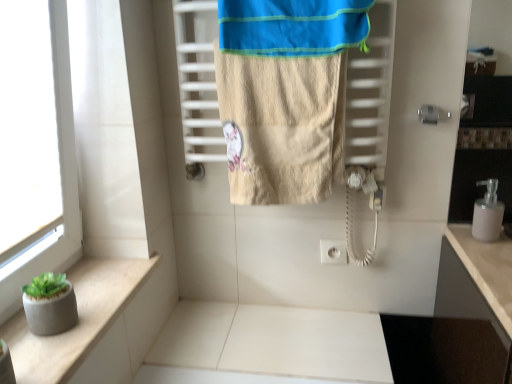
Question: Considering the relative positions of pink matte soap dispenser at right and beige textured towel at center in the image provided, is pink matte soap dispenser at right behind beige textured towel at center?

Choices:
 (A) no
 (B) yes

Answer: (B)

Question: Does pink matte soap dispenser at right turn towards beige textured towel at center?

Choices:
 (A) no
 (B) yes

Answer: (A)

Question: Can you confirm if pink matte soap dispenser at right is positioned to the right of beige textured towel at center?

Choices:
 (A) yes
 (B) no

Answer: (A)

Question: From a real-world perspective, is pink matte soap dispenser at right on beige textured towel at center?

Choices:
 (A) yes
 (B) no

Answer: (B)

Question: Can you confirm if pink matte soap dispenser at right is taller than beige textured towel at center?

Choices:
 (A) yes
 (B) no

Answer: (B)

Question: In terms of width, does pink matte soap dispenser at right look wider or thinner when compared to concrete planter at lower left?

Choices:
 (A) wide
 (B) thin

Answer: (B)

Question: From the image's perspective, is pink matte soap dispenser at right located above or below concrete planter at lower left?

Choices:
 (A) above
 (B) below

Answer: (A)

Question: From a real-world perspective, is pink matte soap dispenser at right above or below concrete planter at lower left?

Choices:
 (A) below
 (B) above

Answer: (B)

Question: Is pink matte soap dispenser at right inside or outside of concrete planter at lower left?

Choices:
 (A) inside
 (B) outside

Answer: (B)

Question: Would you say blue cotton beach towel at upper center is to the left or to the right of pink matte soap dispenser at right in the picture?

Choices:
 (A) right
 (B) left

Answer: (B)

Question: In terms of size, does blue cotton beach towel at upper center appear bigger or smaller than pink matte soap dispenser at right?

Choices:
 (A) big
 (B) small

Answer: (A)

Question: Does point (343, 18) appear closer or farther from the camera than point (496, 228)?

Choices:
 (A) closer
 (B) farther

Answer: (A)

Question: From a real-world perspective, is blue cotton beach towel at upper center above or below pink matte soap dispenser at right?

Choices:
 (A) above
 (B) below

Answer: (A)

Question: Considering the positions of blue cotton beach towel at upper center and beige textured towel at center in the image, is blue cotton beach towel at upper center wider or thinner than beige textured towel at center?

Choices:
 (A) thin
 (B) wide

Answer: (B)

Question: Is blue cotton beach towel at upper center situated inside beige textured towel at center or outside?

Choices:
 (A) outside
 (B) inside

Answer: (A)